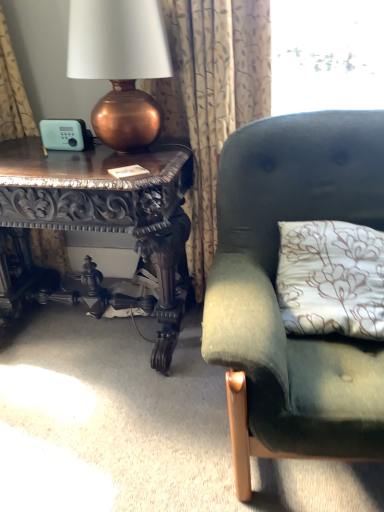
This screenshot has height=512, width=384. What are the coordinates of `free space above carved wood table at left (from a real-world perspective)` in the screenshot? It's located at (100, 157).